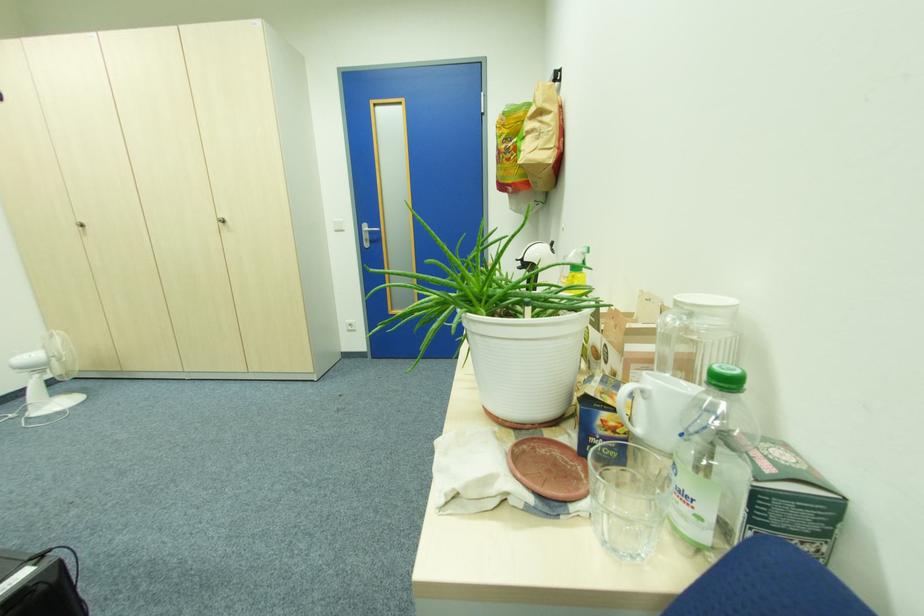
What do you see at coordinates (337, 225) in the screenshot? I see `the white light switch` at bounding box center [337, 225].